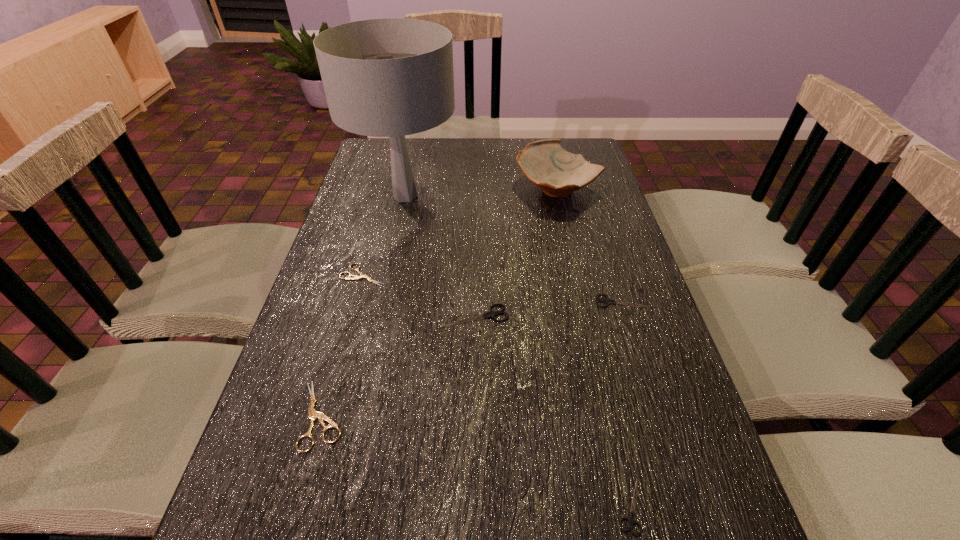
Where is `free spot at the far right corner of the desktop`? free spot at the far right corner of the desktop is located at coordinates coord(587,153).

Image resolution: width=960 pixels, height=540 pixels. Identify the location of free space between the nearer beige shears and the farthest shears. (343, 345).

Find the location of a particular element. unoccupied position between the fifth shortest object and the pottery is located at coordinates (516, 253).

Identify the location of free space between the lampshade and the smaller beige shears. Image resolution: width=960 pixels, height=540 pixels. (384, 235).

You are a GUI agent. You are given a task and a screenshot of the screen. Output one action in this format:
    pyautogui.click(x=<x>, y=<y>)
    Task: Click on the vacant area between the nearest shears and the tallest object
    
    Given the screenshot: What is the action you would take?
    pos(517,352)

The image size is (960, 540). In order to click on vacant space in between the second biggest black shears and the third tallest object in this screenshot , I will do `click(548, 308)`.

Where is `vacant region between the second shears from right to left and the second nearest object`? vacant region between the second shears from right to left and the second nearest object is located at coordinates (476, 461).

This screenshot has height=540, width=960. In order to click on free space between the nearest shears and the tallest object in this screenshot , I will do `click(517, 352)`.

Identify the location of empty location between the brown lampshade and the second nearest object. This screenshot has height=540, width=960. (364, 306).

Locate which object ranks in proximity to the sixth shortest object. Please provide its 2D coordinates. Your answer should be formatted as a tuple, i.e. [(x, y)], where the tuple contains the x and y coordinates of a point satisfying the conditions above.

[(390, 77)]